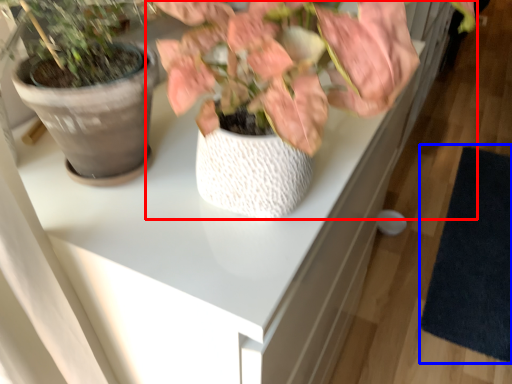
Question: Which of the following is the farthest to the observer, houseplant (highlighted by a red box) or mat (highlighted by a blue box)?

Choices:
 (A) houseplant
 (B) mat

Answer: (B)